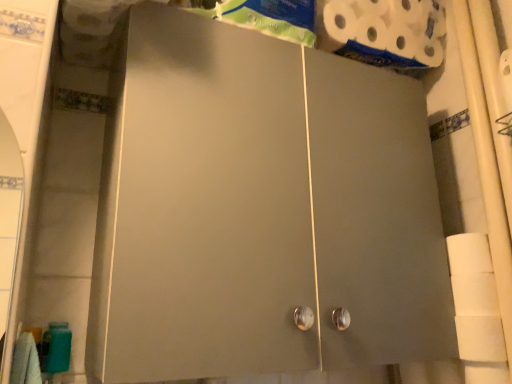
What do you see at coordinates (383, 31) in the screenshot? The width and height of the screenshot is (512, 384). I see `white matte toilet paper at upper right, marked as the second toilet paper in a bottom-to-top arrangement` at bounding box center [383, 31].

This screenshot has height=384, width=512. What are the coordinates of `white matte toilet paper at right, which appears as the 2th toilet paper when viewed from the back` in the screenshot? It's located at (477, 309).

From a real-world perspective, who is located lower, white matte toilet paper at right, acting as the first toilet paper starting from the front, or matte gray cabinet at center?

white matte toilet paper at right, acting as the first toilet paper starting from the front, is physically lower.

Can you tell me how much white matte toilet paper at right, which appears as the 2th toilet paper when viewed from the back, and matte gray cabinet at center differ in facing direction?

91 degrees.

Is white matte toilet paper at right, positioned as the 1th toilet paper in bottom-to-top order, facing away from matte gray cabinet at center?

No, matte gray cabinet at center is not at the back of white matte toilet paper at right, positioned as the 1th toilet paper in bottom-to-top order.

Is white matte toilet paper at right, arranged as the second toilet paper when viewed from the top, wider than matte gray cabinet at center?

In fact, white matte toilet paper at right, arranged as the second toilet paper when viewed from the top, might be narrower than matte gray cabinet at center.

Could you measure the distance between white matte toilet paper at right, positioned as the 1th toilet paper in bottom-to-top order, and white matte toilet paper at upper right, the 1th toilet paper positioned from the top?

white matte toilet paper at right, positioned as the 1th toilet paper in bottom-to-top order, and white matte toilet paper at upper right, the 1th toilet paper positioned from the top, are 25.32 inches apart.

What are the coordinates of `toilet paper below the white matte toilet paper at upper right, the 1th toilet paper positioned from the top (from a real-world perspective)` in the screenshot? It's located at point(477,309).

Is white matte toilet paper at right, positioned as the 1th toilet paper in bottom-to-top order, oriented towards white matte toilet paper at upper right, which appears as the second toilet paper when viewed from the front?

No.

Is white matte toilet paper at right, which appears as the 2th toilet paper when viewed from the back, inside or outside of white matte toilet paper at upper right, the 1th toilet paper positioned from the top?

white matte toilet paper at right, which appears as the 2th toilet paper when viewed from the back, is outside white matte toilet paper at upper right, the 1th toilet paper positioned from the top.

Is white matte toilet paper at upper right, the 1th toilet paper positioned from the top, turned away from matte gray cabinet at center?

white matte toilet paper at upper right, the 1th toilet paper positioned from the top, is not turned away from matte gray cabinet at center.

Considering their positions, is white matte toilet paper at upper right, which appears as the second toilet paper when viewed from the front, located in front of or behind matte gray cabinet at center?

white matte toilet paper at upper right, which appears as the second toilet paper when viewed from the front, is positioned farther from the viewer than matte gray cabinet at center.

From the image's perspective, relative to matte gray cabinet at center, is white matte toilet paper at upper right, the 1th toilet paper positioned from the top, above or below?

Based on their image positions, white matte toilet paper at upper right, the 1th toilet paper positioned from the top, is located above matte gray cabinet at center.

Which object is positioned more to the left, white matte toilet paper at upper right, which appears as the second toilet paper when viewed from the front, or matte gray cabinet at center?

Result: matte gray cabinet at center.

Can you confirm if matte gray cabinet at center is smaller than white matte toilet paper at right, arranged as the second toilet paper when viewed from the top?

Actually, matte gray cabinet at center might be larger than white matte toilet paper at right, arranged as the second toilet paper when viewed from the top.

In the image, is matte gray cabinet at center on the left side or the right side of white matte toilet paper at right, positioned as the 1th toilet paper in bottom-to-top order?

In the image, matte gray cabinet at center appears on the left side of white matte toilet paper at right, positioned as the 1th toilet paper in bottom-to-top order.

Is the surface of matte gray cabinet at center in direct contact with white matte toilet paper at right, which appears as the 2th toilet paper when viewed from the back?

matte gray cabinet at center and white matte toilet paper at right, which appears as the 2th toilet paper when viewed from the back, are not in contact.

Which object is thinner, white matte toilet paper at upper right, acting as the first toilet paper starting from the back, or white matte toilet paper at right, which appears as the 2th toilet paper when viewed from the back?

With smaller width is white matte toilet paper at right, which appears as the 2th toilet paper when viewed from the back.

Between white matte toilet paper at upper right, which appears as the second toilet paper when viewed from the front, and white matte toilet paper at right, acting as the first toilet paper starting from the front, which one has less height?

Standing shorter between the two is white matte toilet paper at upper right, which appears as the second toilet paper when viewed from the front.

Does white matte toilet paper at upper right, acting as the first toilet paper starting from the back, have a smaller size compared to white matte toilet paper at right, acting as the first toilet paper starting from the front?

Incorrect, white matte toilet paper at upper right, acting as the first toilet paper starting from the back, is not smaller in size than white matte toilet paper at right, acting as the first toilet paper starting from the front.

Can you confirm if matte gray cabinet at center is bigger than white matte toilet paper at upper right, acting as the first toilet paper starting from the back?

Yes, matte gray cabinet at center is bigger than white matte toilet paper at upper right, acting as the first toilet paper starting from the back.

Does point (402, 338) lie behind point (328, 18)?

No, it is in front of (328, 18).

Considering the sizes of objects matte gray cabinet at center and white matte toilet paper at upper right, which appears as the second toilet paper when viewed from the front, in the image provided, who is wider, matte gray cabinet at center or white matte toilet paper at upper right, which appears as the second toilet paper when viewed from the front,?

matte gray cabinet at center is wider.

From the image's perspective, is matte gray cabinet at center above or below white matte toilet paper at upper right, marked as the second toilet paper in a bottom-to-top arrangement?

Based on their image positions, matte gray cabinet at center is located beneath white matte toilet paper at upper right, marked as the second toilet paper in a bottom-to-top arrangement.

Where is `the 1st toilet paper behind when counting from the matte gray cabinet at center`? The width and height of the screenshot is (512, 384). the 1st toilet paper behind when counting from the matte gray cabinet at center is located at coordinates (477, 309).

I want to click on toilet paper on the right of white matte toilet paper at upper right, marked as the second toilet paper in a bottom-to-top arrangement, so click(477, 309).

Which object lies further to the anchor point white matte toilet paper at right, arranged as the second toilet paper when viewed from the top, matte gray cabinet at center or white matte toilet paper at upper right, the 1th toilet paper positioned from the top?

white matte toilet paper at upper right, the 1th toilet paper positioned from the top, is positioned further to the anchor white matte toilet paper at right, arranged as the second toilet paper when viewed from the top.

Estimate the real-world distances between objects in this image. Which object is further from matte gray cabinet at center, white matte toilet paper at right, which appears as the 2th toilet paper when viewed from the back, or white matte toilet paper at upper right, which appears as the second toilet paper when viewed from the front?

white matte toilet paper at upper right, which appears as the second toilet paper when viewed from the front, lies further to matte gray cabinet at center than the other object.

Consider the image. When comparing their distances from white matte toilet paper at right, arranged as the second toilet paper when viewed from the top, does white matte toilet paper at upper right, which appears as the second toilet paper when viewed from the front, or matte gray cabinet at center seem closer?

matte gray cabinet at center is closer to white matte toilet paper at right, arranged as the second toilet paper when viewed from the top.

From the image, which object appears to be nearer to matte gray cabinet at center, white matte toilet paper at upper right, the 1th toilet paper positioned from the top, or white matte toilet paper at right, arranged as the second toilet paper when viewed from the top?

white matte toilet paper at right, arranged as the second toilet paper when viewed from the top, is closer to matte gray cabinet at center.

Considering their positions, is white matte toilet paper at right, acting as the first toilet paper starting from the front, positioned closer to white matte toilet paper at upper right, acting as the first toilet paper starting from the back, than matte gray cabinet at center?

Among the two, matte gray cabinet at center is located nearer to white matte toilet paper at upper right, acting as the first toilet paper starting from the back.

Looking at the image, which one is located further to white matte toilet paper at upper right, which appears as the second toilet paper when viewed from the front, matte gray cabinet at center or white matte toilet paper at right, arranged as the second toilet paper when viewed from the top?

white matte toilet paper at right, arranged as the second toilet paper when viewed from the top, is further to white matte toilet paper at upper right, which appears as the second toilet paper when viewed from the front.

You are a GUI agent. You are given a task and a screenshot of the screen. Output one action in this format:
    pyautogui.click(x=<x>, y=<y>)
    Task: Click on the cupboard that lies between white matte toilet paper at upper right, the 1th toilet paper positioned from the top, and white matte toilet paper at right, positioned as the 1th toilet paper in bottom-to-top order, from top to bottom
    
    Given the screenshot: What is the action you would take?
    pyautogui.click(x=263, y=210)